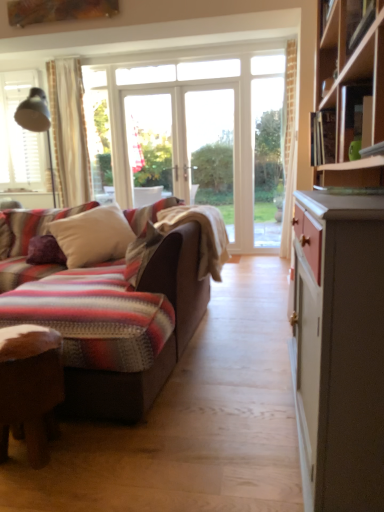
Question: Is purple velvet pillow at left, arranged as the second pillow when viewed from the right, outside of wooden desk at lower left?

Choices:
 (A) yes
 (B) no

Answer: (A)

Question: Considering the relative sizes of purple velvet pillow at left, placed as the first pillow when sorted from left to right, and wooden desk at lower left in the image provided, is purple velvet pillow at left, placed as the first pillow when sorted from left to right, taller than wooden desk at lower left?

Choices:
 (A) no
 (B) yes

Answer: (A)

Question: Does purple velvet pillow at left, arranged as the second pillow when viewed from the right, have a larger size compared to wooden desk at lower left?

Choices:
 (A) yes
 (B) no

Answer: (B)

Question: Is purple velvet pillow at left, arranged as the second pillow when viewed from the right, with wooden desk at lower left?

Choices:
 (A) yes
 (B) no

Answer: (B)

Question: Can you confirm if purple velvet pillow at left, arranged as the second pillow when viewed from the right, is smaller than wooden desk at lower left?

Choices:
 (A) no
 (B) yes

Answer: (B)

Question: In the image, is wooden desk at lower left positioned in front of or behind white soft pillow at center, the second pillow in the left-to-right sequence?

Choices:
 (A) front
 (B) behind

Answer: (A)

Question: Is wooden desk at lower left inside or outside of white soft pillow at center, acting as the 1th pillow starting from the right?

Choices:
 (A) inside
 (B) outside

Answer: (B)

Question: Considering the positions of wooden desk at lower left and white soft pillow at center, the second pillow in the left-to-right sequence, in the image, is wooden desk at lower left taller or shorter than white soft pillow at center, the second pillow in the left-to-right sequence,?

Choices:
 (A) tall
 (B) short

Answer: (B)

Question: Is wooden desk at lower left wider or thinner than white soft pillow at center, the second pillow in the left-to-right sequence?

Choices:
 (A) wide
 (B) thin

Answer: (B)

Question: Considering the positions of striped woolen blanket at center and purple velvet pillow at left, placed as the first pillow when sorted from left to right, in the image, is striped woolen blanket at center taller or shorter than purple velvet pillow at left, placed as the first pillow when sorted from left to right,?

Choices:
 (A) short
 (B) tall

Answer: (B)

Question: From a real-world perspective, relative to purple velvet pillow at left, placed as the first pillow when sorted from left to right, is striped woolen blanket at center vertically above or below?

Choices:
 (A) above
 (B) below

Answer: (A)

Question: Considering the positions of point (215, 222) and point (28, 261), is point (215, 222) closer or farther from the camera than point (28, 261)?

Choices:
 (A) closer
 (B) farther

Answer: (A)

Question: From the image's perspective, relative to purple velvet pillow at left, placed as the first pillow when sorted from left to right, is striped woolen blanket at center above or below?

Choices:
 (A) above
 (B) below

Answer: (A)

Question: From the image's perspective, relative to white soft pillow at center, the second pillow in the left-to-right sequence, is purple velvet pillow at left, placed as the first pillow when sorted from left to right, above or below?

Choices:
 (A) above
 (B) below

Answer: (B)

Question: From a real-world perspective, relative to white soft pillow at center, acting as the 1th pillow starting from the right, is purple velvet pillow at left, placed as the first pillow when sorted from left to right, vertically above or below?

Choices:
 (A) below
 (B) above

Answer: (A)